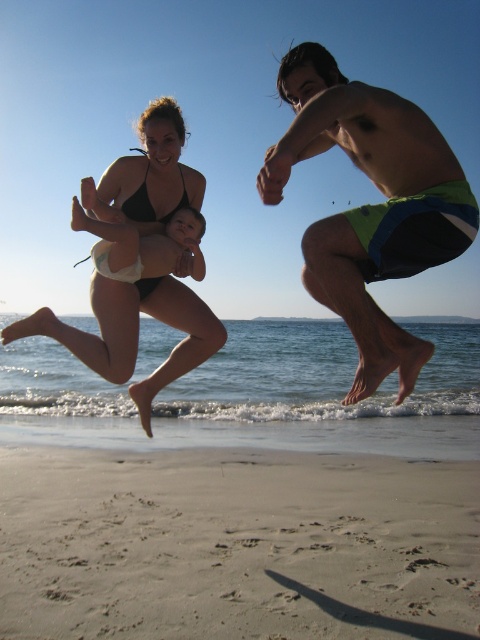
Question: Can you confirm if light beige sand at lower center is smaller than black matte bikini at upper left?

Choices:
 (A) no
 (B) yes

Answer: (B)

Question: Estimate the real-world distances between objects in this image. Which object is farther from the green and blue swim trunks at right?

Choices:
 (A) black matte bikini at upper center
 (B) black matte bikini top at upper center
 (C) light beige sand at lower center

Answer: (C)

Question: Which of the following is the closest to the observer?

Choices:
 (A) (277, 77)
 (B) (129, 209)
 (C) (149, 214)

Answer: (A)

Question: Is green and blue swim trunks at right to the left of black matte bikini at upper center from the viewer's perspective?

Choices:
 (A) no
 (B) yes

Answer: (A)

Question: Which point is closer to the camera?

Choices:
 (A) black matte bikini at upper left
 (B) light beige sand at lower center
 (C) black matte bikini top at upper center

Answer: (C)

Question: Does black matte bikini at upper center come behind black matte bikini top at center?

Choices:
 (A) yes
 (B) no

Answer: (B)